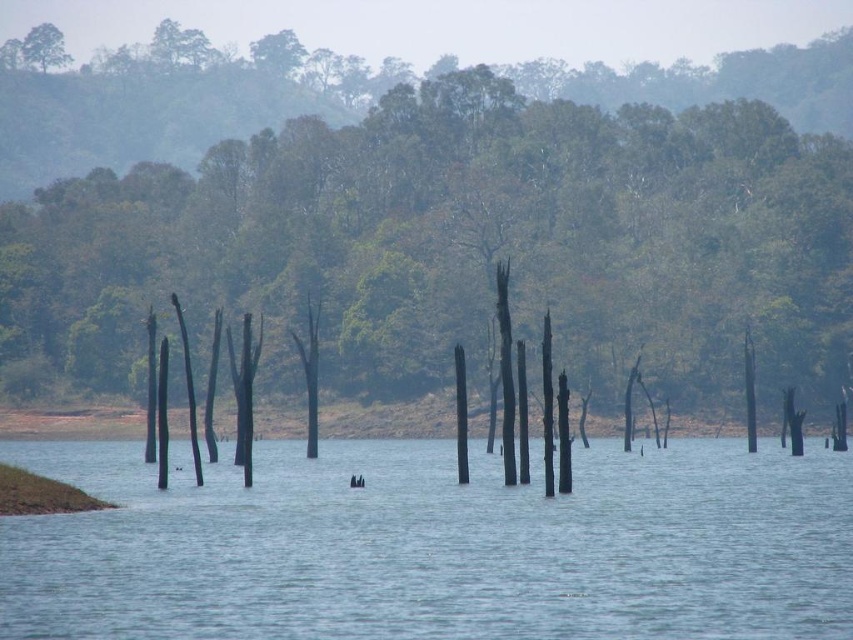
You are standing at the edge of the water and want to place a small wooden boat on the blue water at center. The boat requires a width of 2 meters to avoid hitting the brown wood tree at center. Is there enough space between them?

The brown wood tree at center might be wider than blue water at center, so there may not be enough space for the boat to avoid hitting the tree. Check the actual width before placing the boat.

You are standing at the edge of the water in the serene natural landscape. You notice two points marked in the image. Which point, point (532, 458) or point (33, 56), is closer to you?

Point (532, 458) is closer to the viewer than point (33, 56).